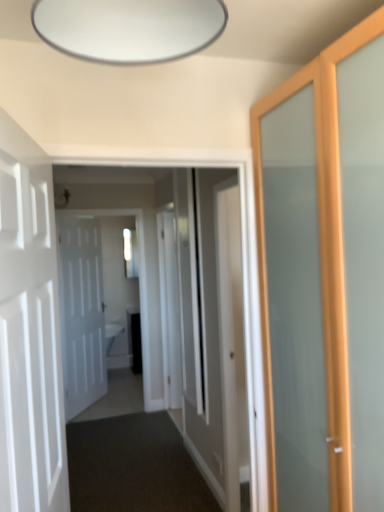
Question: From a real-world perspective, does dark carpet at center, marked as the 1th path in a front-to-back arrangement, sit lower than white glossy door at center, marked as the 2th path in a front-to-back arrangement?

Choices:
 (A) no
 (B) yes

Answer: (A)

Question: Is dark carpet at center, marked as the 1th path in a front-to-back arrangement, positioned before white glossy door at center, marked as the 2th path in a front-to-back arrangement?

Choices:
 (A) yes
 (B) no

Answer: (A)

Question: Can you confirm if dark carpet at center, which is counted as the 2th path, starting from the back, is wider than white glossy door at center, positioned as the first path in back-to-front order?

Choices:
 (A) yes
 (B) no

Answer: (A)

Question: Is dark carpet at center, marked as the 1th path in a front-to-back arrangement, not close to white glossy door at center, positioned as the first path in back-to-front order?

Choices:
 (A) yes
 (B) no

Answer: (B)

Question: Considering the relative sizes of dark carpet at center, marked as the 1th path in a front-to-back arrangement, and white glossy door at center, positioned as the first path in back-to-front order, in the image provided, is dark carpet at center, marked as the 1th path in a front-to-back arrangement, smaller than white glossy door at center, positioned as the first path in back-to-front order,?

Choices:
 (A) yes
 (B) no

Answer: (A)

Question: Considering the positions of point (6, 163) and point (117, 397), is point (6, 163) closer or farther from the camera than point (117, 397)?

Choices:
 (A) farther
 (B) closer

Answer: (B)

Question: From a real-world perspective, is white matte door at left, the 2th door in the left-to-right sequence, above or below white glossy door at center, marked as the 2th path in a front-to-back arrangement?

Choices:
 (A) below
 (B) above

Answer: (B)

Question: Relative to white glossy door at center, marked as the 2th path in a front-to-back arrangement, is white matte door at left, the 2th door in the left-to-right sequence, in front or behind?

Choices:
 (A) front
 (B) behind

Answer: (A)

Question: Based on their positions, is white matte door at left, which is the 3th door in back-to-front order, located to the left or right of white glossy door at center, positioned as the first path in back-to-front order?

Choices:
 (A) left
 (B) right

Answer: (B)

Question: Considering their positions, is white glossy door at center located in front of or behind white glossy door at center, the second door from the back?

Choices:
 (A) behind
 (B) front

Answer: (B)

Question: Based on their sizes in the image, would you say white glossy door at center is bigger or smaller than white glossy door at center, the 3th door positioned from the left?

Choices:
 (A) big
 (B) small

Answer: (B)

Question: From a real-world perspective, relative to white glossy door at center, arranged as the second door when viewed from the front, is white glossy door at center vertically above or below?

Choices:
 (A) above
 (B) below

Answer: (A)

Question: Is point (150, 328) positioned closer to the camera than point (241, 310)?

Choices:
 (A) farther
 (B) closer

Answer: (A)

Question: Considering the positions of white glossy door at center, which is the 1th door in right-to-left order, and white matte door at left, the 2th door viewed from the right, in the image, is white glossy door at center, which is the 1th door in right-to-left order, taller or shorter than white matte door at left, the 2th door viewed from the right,?

Choices:
 (A) short
 (B) tall

Answer: (B)

Question: Choose the correct answer: Is white glossy door at center, arranged as the second door when viewed from the front, inside white matte door at left, which is the 3th door in back-to-front order, or outside it?

Choices:
 (A) outside
 (B) inside

Answer: (A)